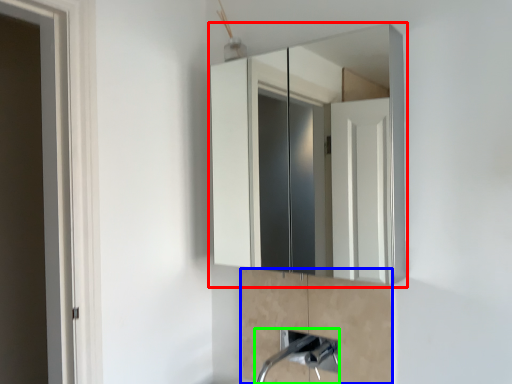
Question: Based on their relative distances, which object is farther from medicine cabinet (highlighted by a red box)? Choose from cabinetry (highlighted by a blue box) and plumbing fixture (highlighted by a green box).

Choices:
 (A) cabinetry
 (B) plumbing fixture

Answer: (B)